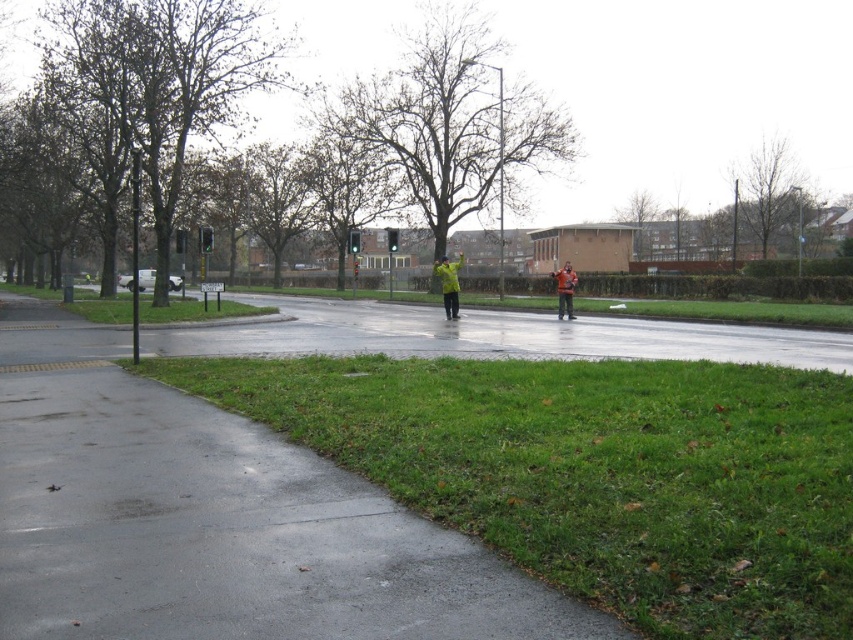
Question: Considering the real-world distances, which object is closest to the orange fabric jacket at center?

Choices:
 (A) yellow reflective jacket at center
 (B) green grass at lower right

Answer: (A)

Question: Does green grass at lower right come behind orange fabric jacket at center?

Choices:
 (A) no
 (B) yes

Answer: (A)

Question: Is green grass at lower right bigger than orange fabric jacket at center?

Choices:
 (A) yes
 (B) no

Answer: (B)

Question: Among these objects, which one is farthest from the camera?

Choices:
 (A) green grass at lower right
 (B) orange fabric jacket at center

Answer: (B)

Question: Does yellow reflective jacket at center appear over orange fabric jacket at center?

Choices:
 (A) yes
 (B) no

Answer: (B)

Question: Which object appears farthest from the camera in this image?

Choices:
 (A) green grass at lower right
 (B) yellow reflective jacket at center
 (C) orange fabric jacket at center

Answer: (B)